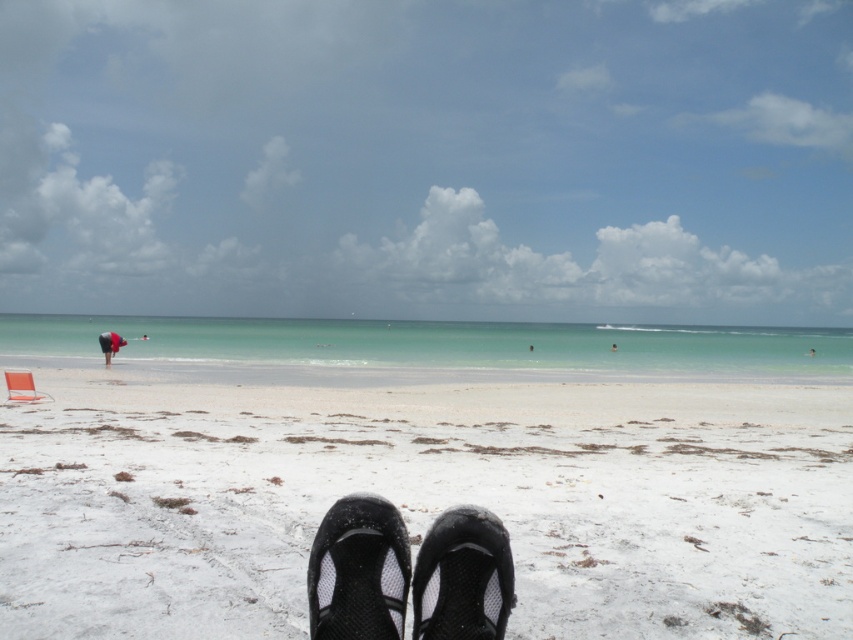
Is the position of white sandy beach at center more distant than that of black mesh shoe at center?

Yes, it is.

In the scene shown: Can you confirm if white sandy beach at center is thinner than black mesh shoe at center?

No, white sandy beach at center is not thinner than black mesh shoe at center.

Is point (728, 540) behind point (448, 625)?

Yes, point (728, 540) is behind point (448, 625).

The width and height of the screenshot is (853, 640). In order to click on white sandy beach at center in this screenshot , I will do `click(427, 500)`.

Between white sandy beach at center and dark blue fabric person at center, which one has more height?

white sandy beach at center

Between point (53, 428) and point (611, 349), which one is positioned in front?

Point (53, 428) is in front.

Find the location of a particular element. This screenshot has width=853, height=640. white sandy beach at center is located at coordinates (427, 500).

Can you confirm if black fabric person at left is taller than dark blue fabric person at center?

No, black fabric person at left is not taller than dark blue fabric person at center.

Is black fabric person at left to the right of dark blue fabric person at center from the viewer's perspective?

In fact, black fabric person at left is to the left of dark blue fabric person at center.

Describe the element at coordinates (109, 344) in the screenshot. This screenshot has width=853, height=640. I see `black fabric person at left` at that location.

Image resolution: width=853 pixels, height=640 pixels. I want to click on black fabric person at left, so click(x=109, y=344).